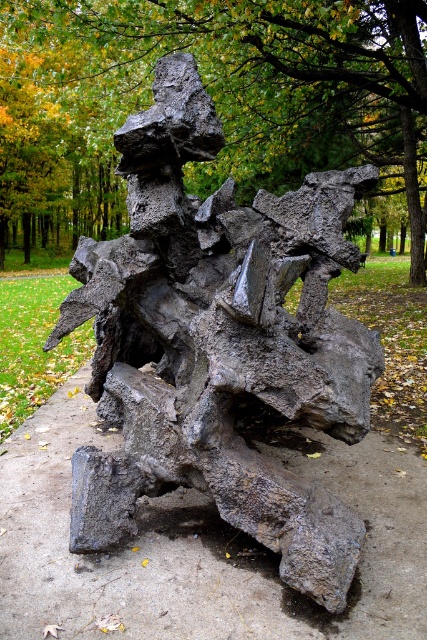
Question: Which object appears closest to the camera in this image?

Choices:
 (A) green leafy tree at upper center
 (B) rusty metal sculpture at center
 (C) rusty metallic sculpture at center

Answer: (C)

Question: Is rusty metal sculpture at center closer to camera compared to rusty metallic sculpture at center?

Choices:
 (A) yes
 (B) no

Answer: (B)

Question: Among these points, which one is farthest from the camera?

Choices:
 (A) (347, 106)
 (B) (216, 204)

Answer: (A)

Question: Which of the following is the closest to the observer?

Choices:
 (A) (184, 88)
 (B) (395, 488)

Answer: (A)

Question: Can you confirm if green leafy tree at upper center is wider than rusty metallic sculpture at center?

Choices:
 (A) no
 (B) yes

Answer: (B)

Question: From the image, what is the correct spatial relationship of green leafy tree at upper center in relation to rusty metallic sculpture at center?

Choices:
 (A) above
 (B) below

Answer: (A)